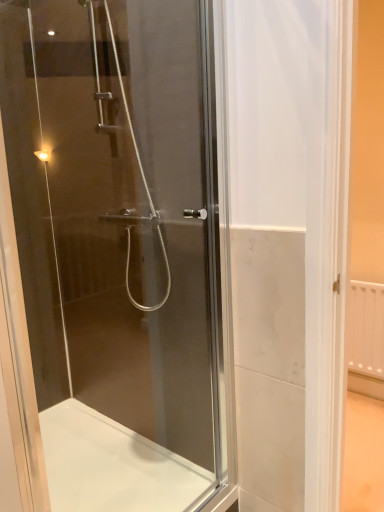
Describe the element at coordinates (117, 250) in the screenshot. I see `transparent glass shower door at center` at that location.

Measure the distance between transparent glass shower door at center and camera.

transparent glass shower door at center and camera are 3.86 feet apart.

Where is `transparent glass shower door at center`? The image size is (384, 512). transparent glass shower door at center is located at coordinates (117, 250).

I want to click on white glossy bath at lower center, so click(x=112, y=465).

Describe the element at coordinates (112, 465) in the screenshot. The width and height of the screenshot is (384, 512). I see `white glossy bath at lower center` at that location.

Locate an element on the screen. The height and width of the screenshot is (512, 384). transparent glass shower door at center is located at coordinates (117, 250).

Which is more to the left, transparent glass shower door at center or white glossy bath at lower center?

From the viewer's perspective, white glossy bath at lower center appears more on the left side.

Which object is closer to the camera taking this photo, transparent glass shower door at center or white glossy bath at lower center?

transparent glass shower door at center is in front.

Does point (220, 311) come in front of point (187, 503)?

That is True.

From the image's perspective, is transparent glass shower door at center beneath white glossy bath at lower center?

No, from the image's perspective, transparent glass shower door at center is not beneath white glossy bath at lower center.

From a real-world perspective, which object rests below the other?

From a 3D spatial view, white glossy bath at lower center is below.

Which object is thinner, transparent glass shower door at center or white glossy bath at lower center?

transparent glass shower door at center is thinner.

Who is taller, transparent glass shower door at center or white glossy bath at lower center?

transparent glass shower door at center is taller.

Which of these two, transparent glass shower door at center or white glossy bath at lower center, is bigger?

With larger size is white glossy bath at lower center.

Would you say transparent glass shower door at center is outside white glossy bath at lower center?

Absolutely, transparent glass shower door at center is external to white glossy bath at lower center.

Is transparent glass shower door at center positioned far away from white glossy bath at lower center?

No, there isn't a large distance between transparent glass shower door at center and white glossy bath at lower center.

Is transparent glass shower door at center oriented towards white glossy bath at lower center?

No, transparent glass shower door at center is not aimed at white glossy bath at lower center.

What's the angular difference between transparent glass shower door at center and white glossy bath at lower center's facing directions?

There is a 0.00382-degree angle between the facing directions of transparent glass shower door at center and white glossy bath at lower center.

This screenshot has height=512, width=384. What are the coordinates of `screen door in front of the white glossy bath at lower center` in the screenshot? It's located at (117, 250).

Consider the image. Between white glossy bath at lower center and transparent glass shower door at center, which one appears on the right side from the viewer's perspective?

Positioned to the right is transparent glass shower door at center.

Is the position of white glossy bath at lower center less distant than that of transparent glass shower door at center?

No, white glossy bath at lower center is further to the viewer.

Which point is more forward, (48, 481) or (74, 490)?

Positioned in front is point (74, 490).

From the image's perspective, between white glossy bath at lower center and transparent glass shower door at center, which one is located above?

transparent glass shower door at center appears higher in the image.

From a real-world perspective, is white glossy bath at lower center located higher than transparent glass shower door at center?

No, from a real-world perspective, white glossy bath at lower center is not above transparent glass shower door at center.

In the scene shown: Looking at their sizes, would you say white glossy bath at lower center is wider or thinner than transparent glass shower door at center?

Considering their sizes, white glossy bath at lower center looks broader than transparent glass shower door at center.

Is white glossy bath at lower center taller or shorter than transparent glass shower door at center?

Clearly, white glossy bath at lower center is shorter compared to transparent glass shower door at center.

Considering the sizes of objects white glossy bath at lower center and transparent glass shower door at center in the image provided, who is bigger, white glossy bath at lower center or transparent glass shower door at center?

white glossy bath at lower center.

Is white glossy bath at lower center inside or outside of transparent glass shower door at center?

white glossy bath at lower center lies outside transparent glass shower door at center.

Is white glossy bath at lower center not close to transparent glass shower door at center?

white glossy bath at lower center is actually quite close to transparent glass shower door at center.

Is white glossy bath at lower center turned away from transparent glass shower door at center?

white glossy bath at lower center is not turned away from transparent glass shower door at center.

Can you tell me how much white glossy bath at lower center and transparent glass shower door at center differ in facing direction?

They differ by 0.00382 degrees in their facing directions.

Where is `screen door that is on the right side of white glossy bath at lower center`? This screenshot has height=512, width=384. screen door that is on the right side of white glossy bath at lower center is located at coordinates (117, 250).

Identify the location of bath below the transparent glass shower door at center (from the image's perspective). (112, 465).

This screenshot has width=384, height=512. Find the location of `screen door located in front of the white glossy bath at lower center`. screen door located in front of the white glossy bath at lower center is located at coordinates (117, 250).